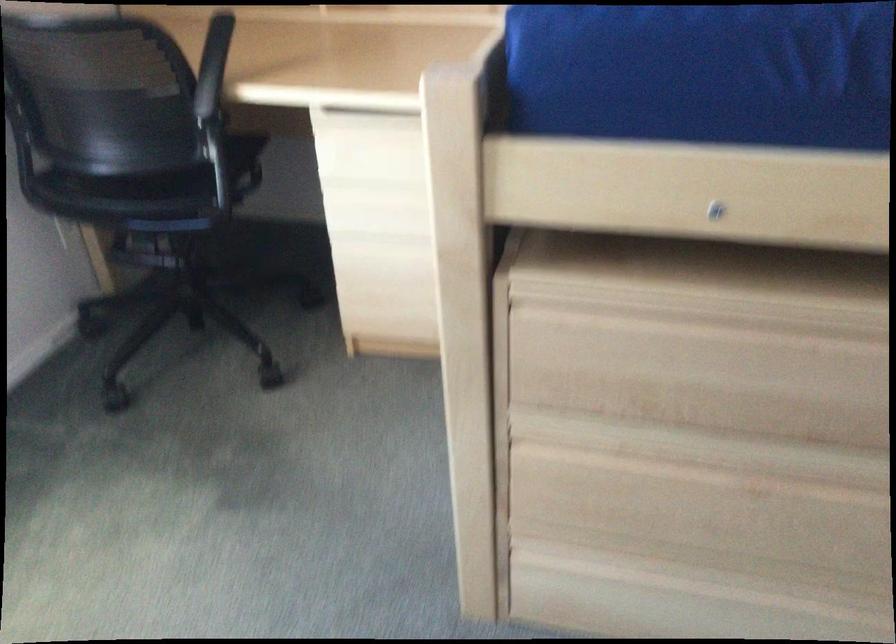
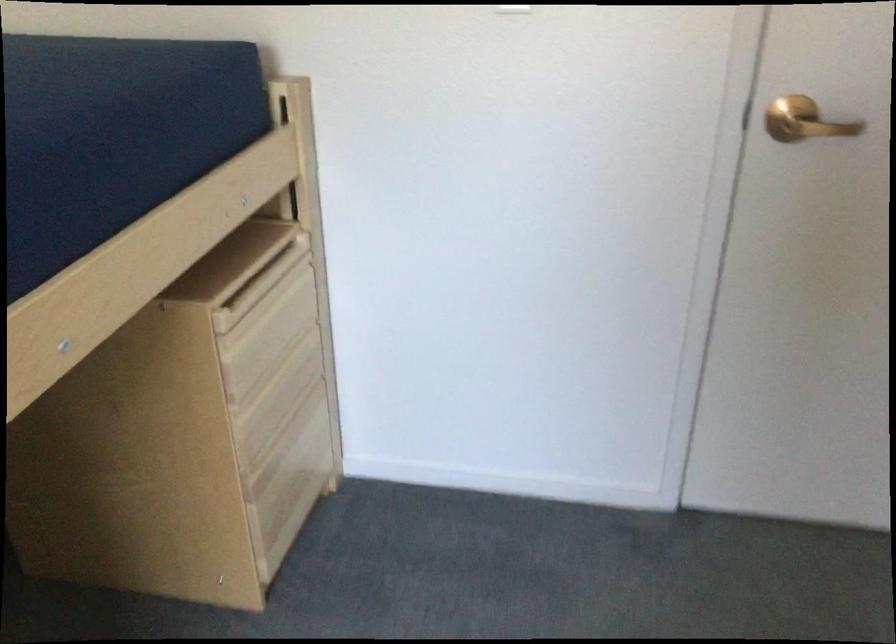
Based on the continuous images, in which direction is the camera rotating?

The rotation direction of the camera is right-down.